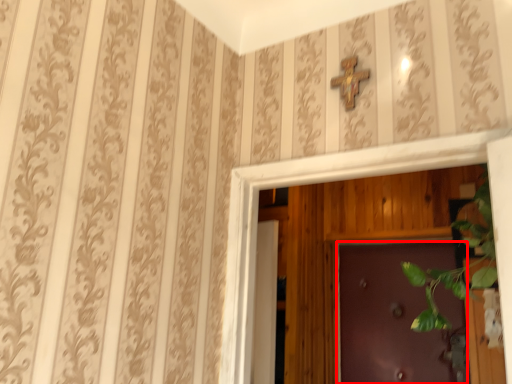
Question: Observing the image, what is the correct spatial positioning of door (annotated by the red box) in reference to cross?

Choices:
 (A) left
 (B) right

Answer: (B)